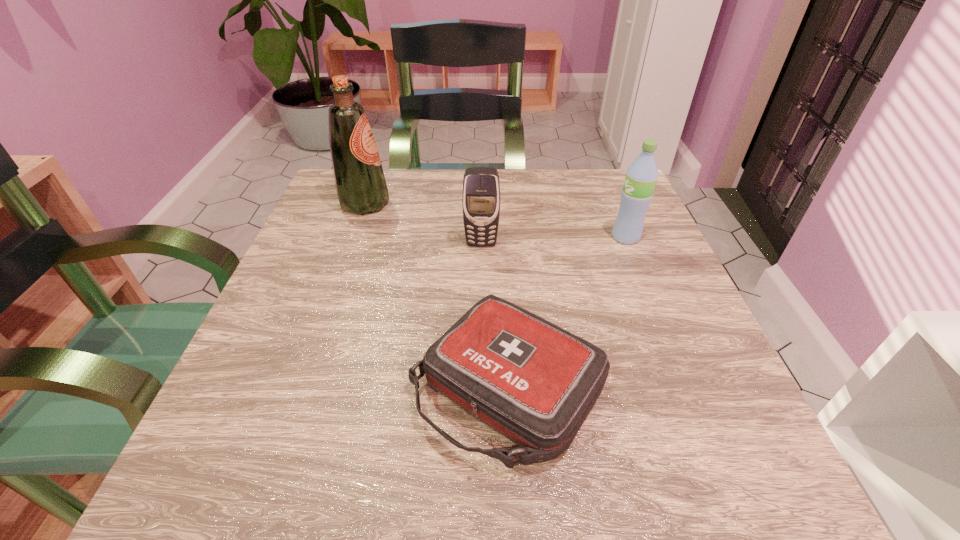
The width and height of the screenshot is (960, 540). What are the coordinates of `object that is the second closest to the nearest object` in the screenshot? It's located at (641, 177).

Find the location of a particular element. The image size is (960, 540). vacant region that satisfies the following two spatial constraints: 1. on the front-facing side of the olive oil; 2. on the back side of the water bottle is located at coordinates (353, 237).

Identify the location of blank area in the image that satisfies the following two spatial constraints: 1. on the front-facing side of the tallest object; 2. on the back side of the rightmost object. (353, 237).

Find the location of a particular element. The height and width of the screenshot is (540, 960). blank space that satisfies the following two spatial constraints: 1. on the front-facing side of the farthest object; 2. on the right side of the water bottle is located at coordinates (353, 237).

This screenshot has width=960, height=540. Identify the location of vacant area in the image that satisfies the following two spatial constraints: 1. on the front face of the cellular telephone; 2. on the left side of the first-aid kit. (482, 388).

Identify the location of vacant point that satisfies the following two spatial constraints: 1. on the front-facing side of the farthest object; 2. on the back side of the nearest object. [300, 388].

You are a GUI agent. You are given a task and a screenshot of the screen. Output one action in this format:
    pyautogui.click(x=<x>, y=<y>)
    Task: Click on the free space in the image that satisfies the following two spatial constraints: 1. on the front-facing side of the leftmost object; 2. on the left side of the third shortest object
    The height and width of the screenshot is (540, 960).
    Given the screenshot: What is the action you would take?
    pyautogui.click(x=353, y=237)